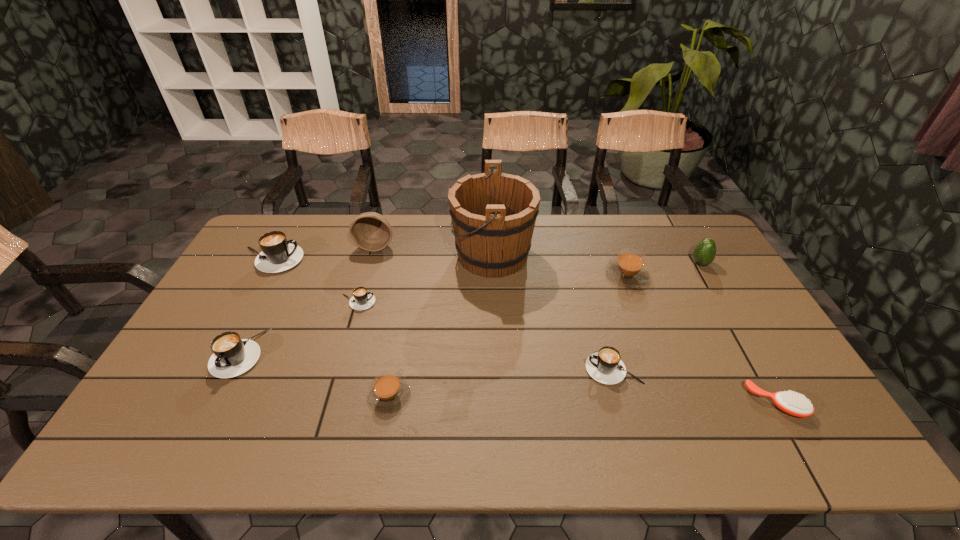
You are a GUI agent. You are given a task and a screenshot of the screen. Output one action in this format:
    pyautogui.click(x=<x>, y=<y>)
    Task: Click on the free space between the nearer brown cappuccino and the second biggest black cappuccino
    
    Given the screenshot: What is the action you would take?
    pyautogui.click(x=314, y=374)

Image resolution: width=960 pixels, height=540 pixels. I want to click on free space between the smallest black cappuccino and the sixth object from right to left, so click(x=373, y=349).

At what (x,y) coordinates should I click in order to perform the action: click on free space between the hairbrush and the fourth cappuccino from right to left. Please return your answer as a coordinate pair (x, y). Looking at the image, I should click on (566, 353).

Where is `vacant space that's between the bowl and the third cappuccino from left to right`? This screenshot has width=960, height=540. vacant space that's between the bowl and the third cappuccino from left to right is located at coordinates (367, 274).

What are the coordinates of `empty space between the second tallest object and the third biggest black cappuccino` in the screenshot? It's located at (494, 307).

Locate an element on the screen. This screenshot has width=960, height=540. blank region between the tallest object and the farther brown cappuccino is located at coordinates (560, 265).

The width and height of the screenshot is (960, 540). What are the coordinates of `empty location between the bigger brown cappuccino and the rightmost black cappuccino` in the screenshot? It's located at (620, 322).

Find the location of a particular element. This screenshot has width=960, height=540. free spot between the rightmost black cappuccino and the shortest cappuccino is located at coordinates (486, 336).

At what (x,y) coordinates should I click in order to perform the action: click on vacant area between the second biggest black cappuccino and the bigger brown cappuccino. Please return your answer as a coordinate pair (x, y). Image resolution: width=960 pixels, height=540 pixels. Looking at the image, I should click on (433, 314).

Image resolution: width=960 pixels, height=540 pixels. Find the location of `object that is the ninth closest to the farther brown cappuccino`. object that is the ninth closest to the farther brown cappuccino is located at coordinates (232, 356).